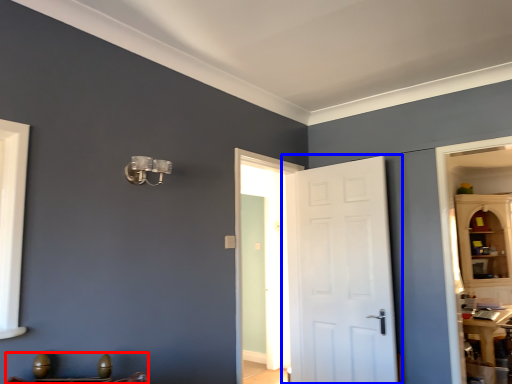
Question: Which object appears closest to the camera in this image, furniture (highlighted by a red box) or door (highlighted by a blue box)?

Choices:
 (A) furniture
 (B) door

Answer: (A)